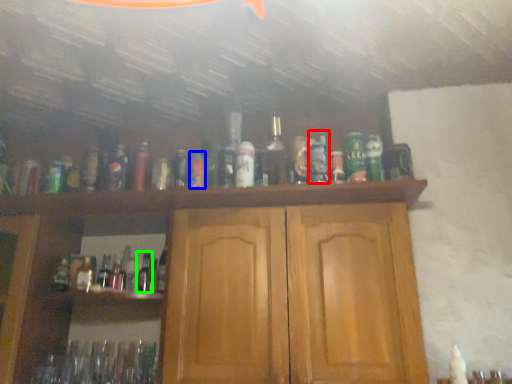
Question: Which is nearer to the bottle (highlighted by a red box)? bottle (highlighted by a blue box) or bottle (highlighted by a green box).

Choices:
 (A) bottle
 (B) bottle

Answer: (A)